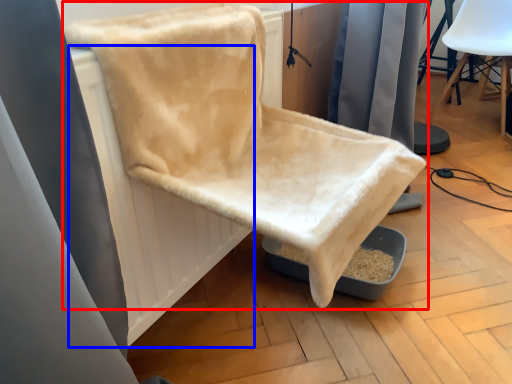
Question: Which object appears farthest to the camera in this image, chair (highlighted by a red box) or radiator (highlighted by a blue box)?

Choices:
 (A) chair
 (B) radiator

Answer: (B)